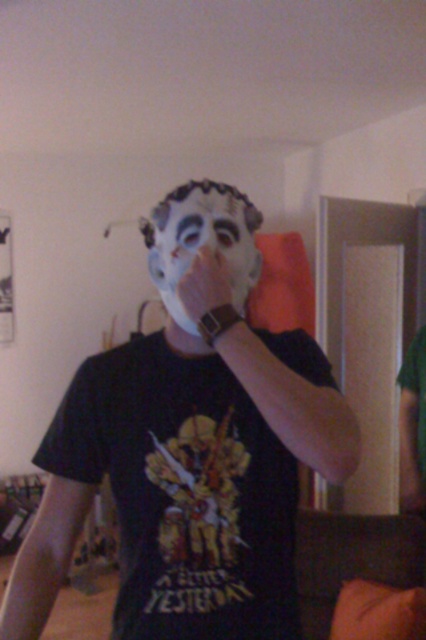
Question: Which point is farther to the camera?

Choices:
 (A) (135, 486)
 (B) (189, 192)

Answer: (B)

Question: Which of the following is the farthest from the observer?

Choices:
 (A) white matte mask at center
 (B) matte white mask at center

Answer: (A)

Question: Can you confirm if matte white mask at center is positioned to the left of white matte mask at center?

Choices:
 (A) no
 (B) yes

Answer: (A)

Question: Does matte white mask at center appear over white matte mask at center?

Choices:
 (A) no
 (B) yes

Answer: (A)

Question: Is matte white mask at center positioned behind white matte mask at center?

Choices:
 (A) yes
 (B) no

Answer: (B)